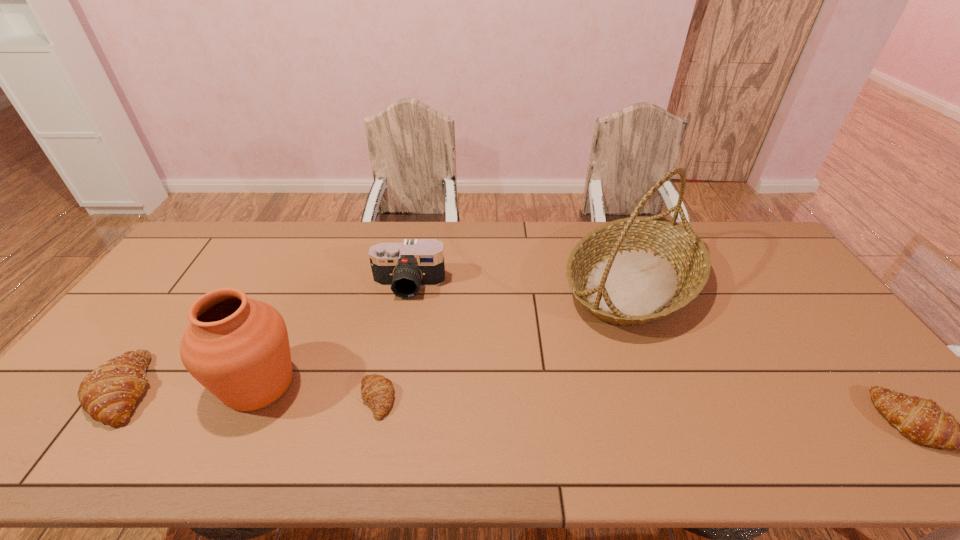
Please point a space for a new crescent_roll to maintain equal intervals. Please provide its 2D coordinates. Your answer should be formatted as a tuple, i.e. [(x, y)], where the tuple contains the x and y coordinates of a point satisfying the conditions above.

[(638, 409)]